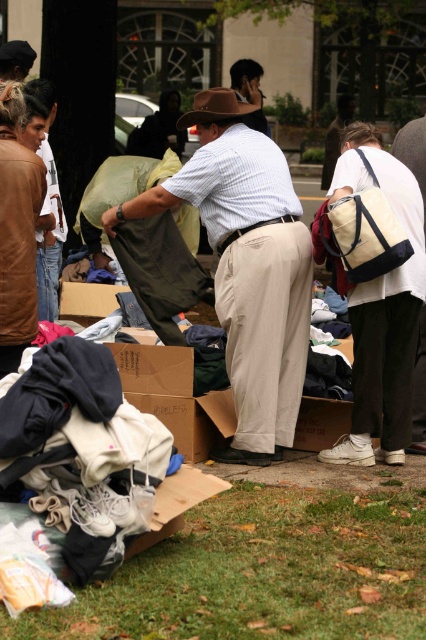
Question: Which point appears farthest from the camera in this image?

Choices:
 (A) (353, 157)
 (B) (406, 157)

Answer: (B)

Question: Is khaki cotton pants at center to the left of denim pants at left from the viewer's perspective?

Choices:
 (A) no
 (B) yes

Answer: (A)

Question: Is green grass at lower center closer to camera compared to matte brown hat at center?

Choices:
 (A) yes
 (B) no

Answer: (A)

Question: Which object is positioned farthest from the denim pants at left?

Choices:
 (A) brown leather jacket at left
 (B) khaki cotton pants at center

Answer: (B)

Question: Can you confirm if khaki cotton pants at center is positioned below matte brown hat at center?

Choices:
 (A) no
 (B) yes

Answer: (B)

Question: Which is farther from the khaki cotton pants at center?

Choices:
 (A) matte brown hat at center
 (B) brown leather jacket at left

Answer: (A)